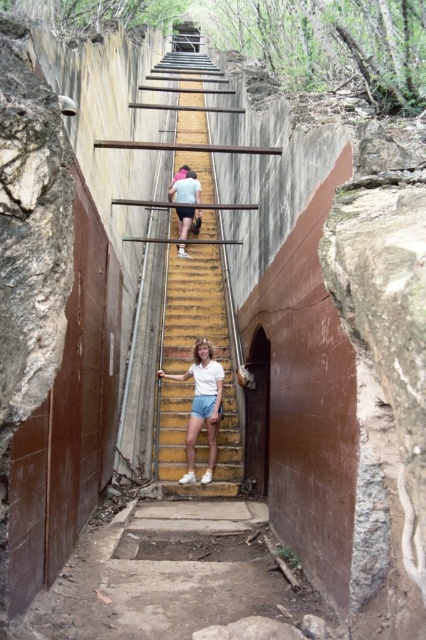
You are a photographer trying to capture the entire scene of the yellow painted wood stairs at center and the white matte shirt at center in one shot. Based on their sizes, which object should you focus on to ensure both are clearly visible in the photo?

The yellow painted wood stairs at center is larger in size than the white matte shirt at center. To ensure both are clearly visible, focus on the yellow painted wood stairs at center as it occupies more space in the frame, allowing the smaller white matte shirt at center to be included without cropping either.